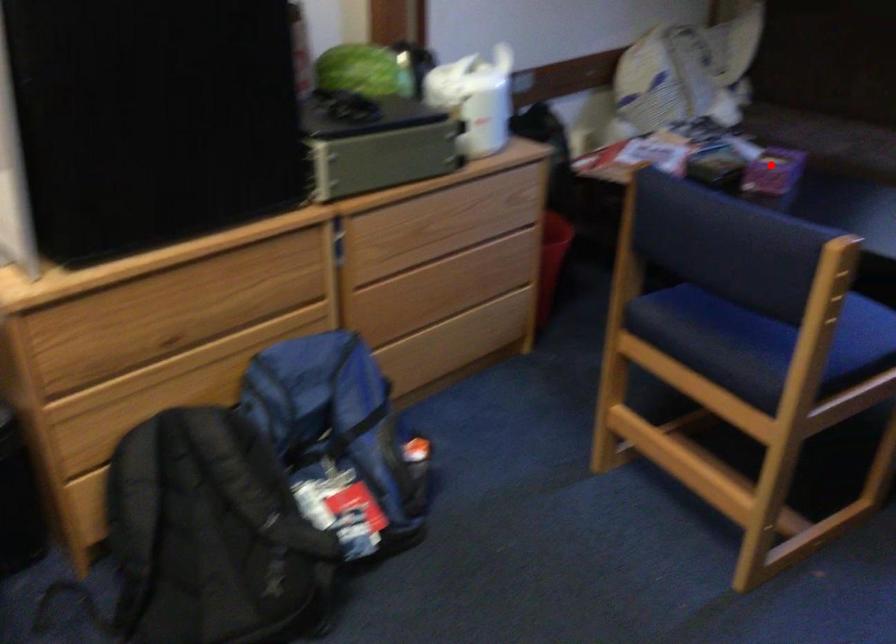
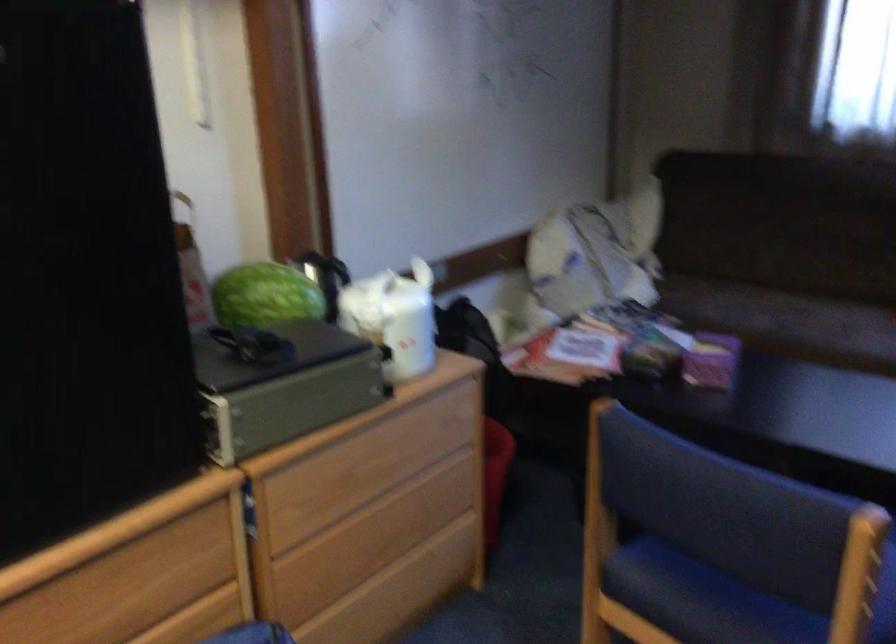
Where in the second image is the point corresponding to the highlighted location from the first image?

(711, 361)